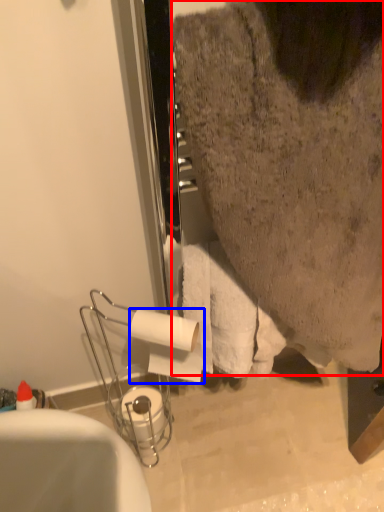
Question: Which of the following is the farthest to the observer, person (highlighted by a red box) or toilet paper (highlighted by a blue box)?

Choices:
 (A) person
 (B) toilet paper

Answer: (B)